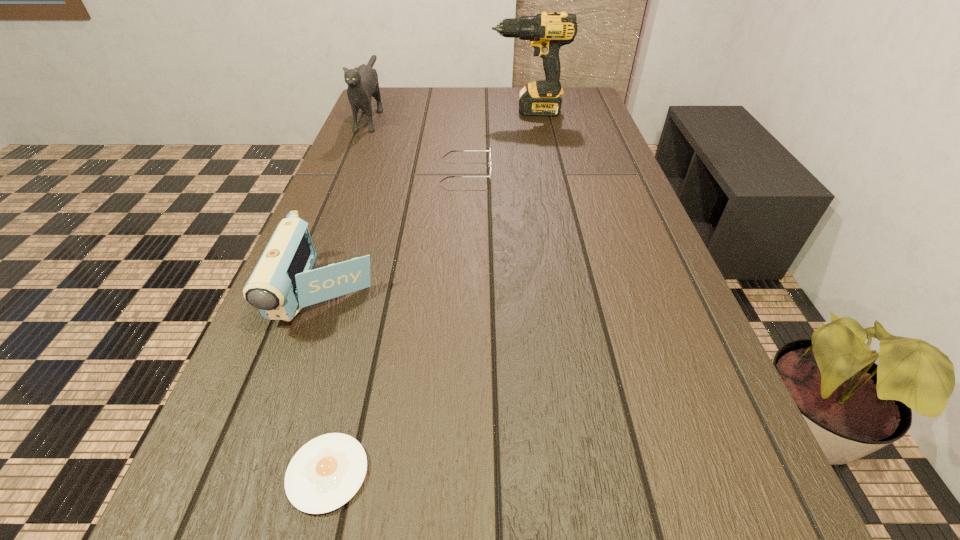
Identify the location of vacant space located 0.180m at the tip of the drill. (436, 111).

Find the location of a particular element. Image resolution: width=960 pixels, height=540 pixels. vacant point located 0.340m at the tip of the drill is located at coordinates (387, 111).

Identify the location of vacant space located on the front-facing side of the cat. (332, 207).

I want to click on free space located 0.240m on the side of the third shortest object with the flip-out screen, so click(x=263, y=480).

In order to click on vacant region located 0.070m on the front-facing side of the third nearest object in this screenshot , I will do `click(518, 172)`.

What are the coordinates of `vacant point located on the back of the shortest object` in the screenshot? It's located at (353, 367).

You are a GUI agent. You are given a task and a screenshot of the screen. Output one action in this format:
    pyautogui.click(x=<x>, y=<y>)
    Task: Click on the drill situated at the far edge
    This screenshot has height=540, width=960.
    Given the screenshot: What is the action you would take?
    pyautogui.click(x=547, y=32)

The height and width of the screenshot is (540, 960). Find the location of `cat that is at the far edge`. cat that is at the far edge is located at coordinates (362, 81).

What are the coordinates of `cat present at the left edge` in the screenshot? It's located at (362, 81).

The width and height of the screenshot is (960, 540). What are the coordinates of `camcorder that is at the left edge` in the screenshot? It's located at (283, 282).